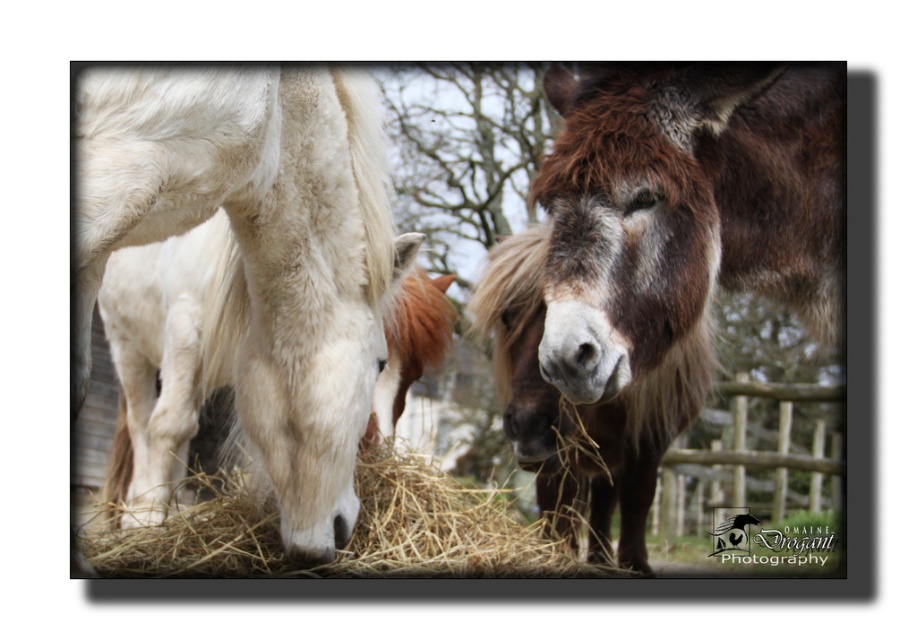
Is white fluffy horse at left positioned behind golden straw at center?

No, white fluffy horse at left is in front of golden straw at center.

Is point (124, 102) farther from camera compared to point (378, 506)?

That is False.

Who is more distant from viewer, (310, 355) or (94, 532)?

The point (94, 532) is behind.

What are the coordinates of `white fluffy horse at left` in the screenshot? It's located at click(260, 253).

Is brown fuzzy mule at center shorter than white fluffy horse at left?

In fact, brown fuzzy mule at center may be taller than white fluffy horse at left.

Is brown fuzzy mule at center further to camera compared to white fluffy horse at left?

Yes, brown fuzzy mule at center is further from the viewer.

What do you see at coordinates (656, 262) in the screenshot? This screenshot has height=640, width=917. I see `brown fuzzy mule at center` at bounding box center [656, 262].

The width and height of the screenshot is (917, 640). Find the location of `brown fuzzy mule at center`. brown fuzzy mule at center is located at coordinates (656, 262).

The image size is (917, 640). What are the coordinates of `brown fuzzy mule at center` in the screenshot? It's located at (656, 262).

Which is above, brown fuzzy mule at center or golden straw at center?

brown fuzzy mule at center is higher up.

Is point (678, 99) positioned before point (584, 573)?

Yes, point (678, 99) is in front of point (584, 573).

Where is `brown fuzzy mule at center`? Image resolution: width=917 pixels, height=640 pixels. brown fuzzy mule at center is located at coordinates (656, 262).